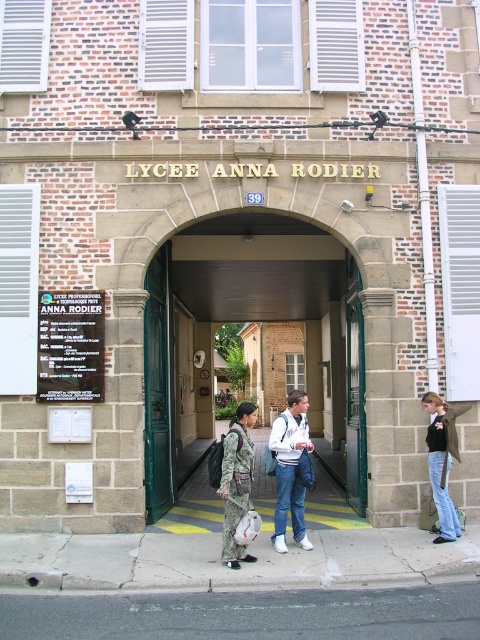
You are a student arriving at Lycie Anna Rodier and need to enter the school. You see the green wooden door at center and the camouflage fabric jacket at center. Which object is higher up?

The green wooden door at center is located above the camouflage fabric jacket at center, so the green wooden door at center is higher up.

You are a visitor at the school entrance and want to enter the building. You see the green wooden door at center and the white matte jacket at center. Which object is bigger and should you focus on for entering?

The green wooden door at center is larger in size than the white matte jacket at center, so you should focus on the green wooden door at center to enter the building.

You are standing at the entrance of Lyc?e Anna Rodier and want to reach the green wooden door at center. There is a camouflage fabric jacket at center in your way. Can you walk straight to the door without moving the jacket?

The distance between the green wooden door at center and the camouflage fabric jacket at center is 5.90 meters. Since the jacket is at the same center position as the door, you would need to move it to reach the door directly.